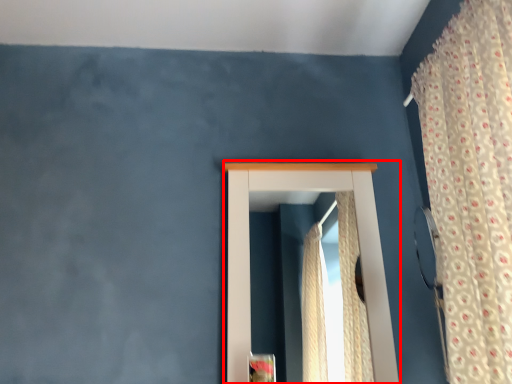
Question: In this image, where is window (annotated by the red box) located relative to curtain?

Choices:
 (A) left
 (B) right

Answer: (A)